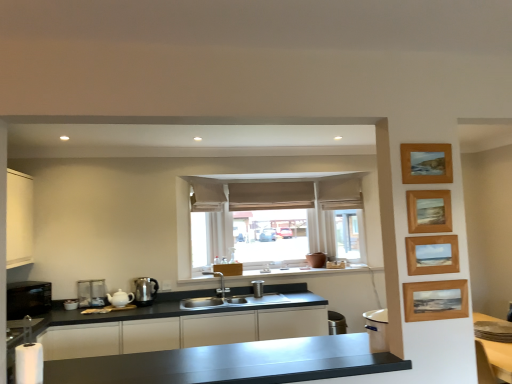
Question: Is wooden picture frame at upper right, which is the second picture frame in top-to-bottom order, positioned with its back to satin silver kettle at lower left, the second appliance in the right-to-left sequence?

Choices:
 (A) no
 (B) yes

Answer: (A)

Question: Is wooden picture frame at upper right, the 3th picture frame ordered from the bottom, to the left of satin silver kettle at lower left, the second appliance in the right-to-left sequence, from the viewer's perspective?

Choices:
 (A) no
 (B) yes

Answer: (A)

Question: Would you say wooden picture frame at upper right, which is the second picture frame in top-to-bottom order, is outside satin silver kettle at lower left, the 2th appliance when ordered from front to back?

Choices:
 (A) no
 (B) yes

Answer: (B)

Question: From the image's perspective, is wooden picture frame at upper right, which is the second picture frame in top-to-bottom order, beneath satin silver kettle at lower left, the 2th appliance viewed from the back?

Choices:
 (A) no
 (B) yes

Answer: (A)

Question: Considering the relative sizes of wooden picture frame at upper right, the 3th picture frame ordered from the bottom, and satin silver kettle at lower left, the second appliance when ordered from left to right, in the image provided, is wooden picture frame at upper right, the 3th picture frame ordered from the bottom, taller than satin silver kettle at lower left, the second appliance when ordered from left to right,?

Choices:
 (A) yes
 (B) no

Answer: (B)

Question: Is wooden picture frame at upper right, which is the second picture frame in top-to-bottom order, with satin silver kettle at lower left, the 2th appliance viewed from the back?

Choices:
 (A) yes
 (B) no

Answer: (B)

Question: Considering the relative sizes of black matte microwave at left, which appears as the third appliance when viewed from the back, and wooden picture frame at right, the third picture frame in the top-to-bottom sequence, in the image provided, is black matte microwave at left, which appears as the third appliance when viewed from the back, smaller than wooden picture frame at right, the third picture frame in the top-to-bottom sequence,?

Choices:
 (A) yes
 (B) no

Answer: (B)

Question: From a real-world perspective, does black matte microwave at left, which is the first appliance in front-to-back order, stand above wooden picture frame at right, the third picture frame in the top-to-bottom sequence?

Choices:
 (A) yes
 (B) no

Answer: (B)

Question: Does black matte microwave at left, positioned as the 1th appliance in left-to-right order, turn towards wooden picture frame at right, the 2th picture frame in the bottom-to-top sequence?

Choices:
 (A) yes
 (B) no

Answer: (A)

Question: Is black matte microwave at left, positioned as the 1th appliance in left-to-right order, taller than wooden picture frame at right, the 2th picture frame in the bottom-to-top sequence?

Choices:
 (A) yes
 (B) no

Answer: (A)

Question: Considering the relative positions of black matte microwave at left, positioned as the 1th appliance in left-to-right order, and wooden picture frame at right, the third picture frame in the top-to-bottom sequence, in the image provided, is black matte microwave at left, positioned as the 1th appliance in left-to-right order, to the right of wooden picture frame at right, the third picture frame in the top-to-bottom sequence, from the viewer's perspective?

Choices:
 (A) no
 (B) yes

Answer: (A)

Question: From a real-world perspective, is black matte microwave at left, which is the first appliance in front-to-back order, beneath wooden picture frame at right, the 2th picture frame in the bottom-to-top sequence?

Choices:
 (A) yes
 (B) no

Answer: (A)

Question: Can you confirm if white matte cabinet at left, placed as the 1th cabinetry when sorted from top to bottom, is thinner than wooden picture frame at upper right, the 3th picture frame ordered from the bottom?

Choices:
 (A) no
 (B) yes

Answer: (A)